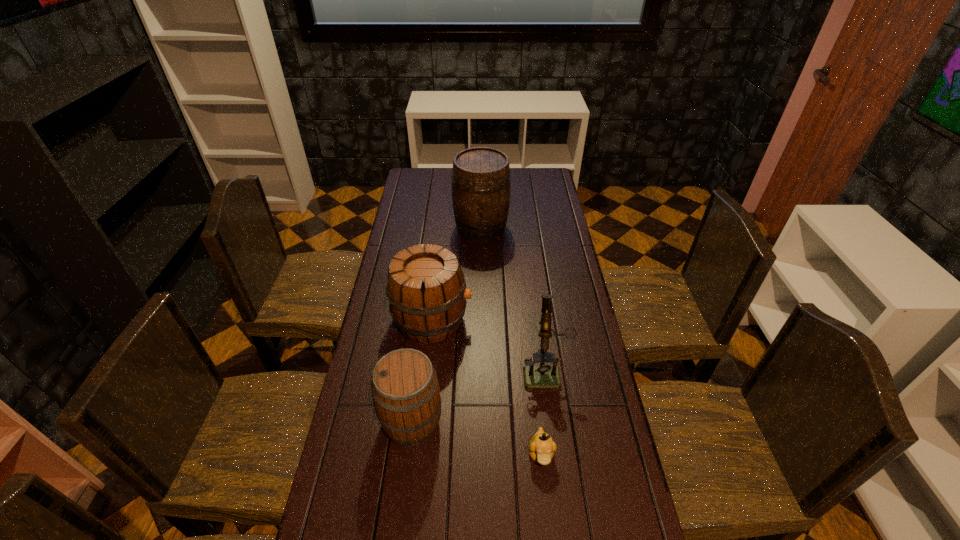
Where is `the farthest cider`? The width and height of the screenshot is (960, 540). the farthest cider is located at coordinates (481, 187).

At what (x,y) coordinates should I click in order to perform the action: click on the tallest object. Please return your answer as a coordinate pair (x, y). Image resolution: width=960 pixels, height=540 pixels. Looking at the image, I should click on (481, 187).

Where is `the third farthest object`? The image size is (960, 540). the third farthest object is located at coordinates (542, 376).

At what (x,y) coordinates should I click in order to perform the action: click on the second farthest cider. Please return your answer as a coordinate pair (x, y). This screenshot has width=960, height=540. Looking at the image, I should click on (426, 288).

This screenshot has width=960, height=540. Identify the location of the nearest cider. (405, 389).

This screenshot has width=960, height=540. Find the location of `duckling`. duckling is located at coordinates click(541, 447).

Where is `vacant space located on the side of the farthest object near the bung hole`? vacant space located on the side of the farthest object near the bung hole is located at coordinates (481, 264).

Identify the location of vacant space positioned 0.110m at the eyepiece of the microscope. (551, 422).

The width and height of the screenshot is (960, 540). Identify the location of vacant space located on the side of the second nearest cider where the spigot is located. (539, 320).

I want to click on free spot located on the right of the nearest cider, so click(468, 422).